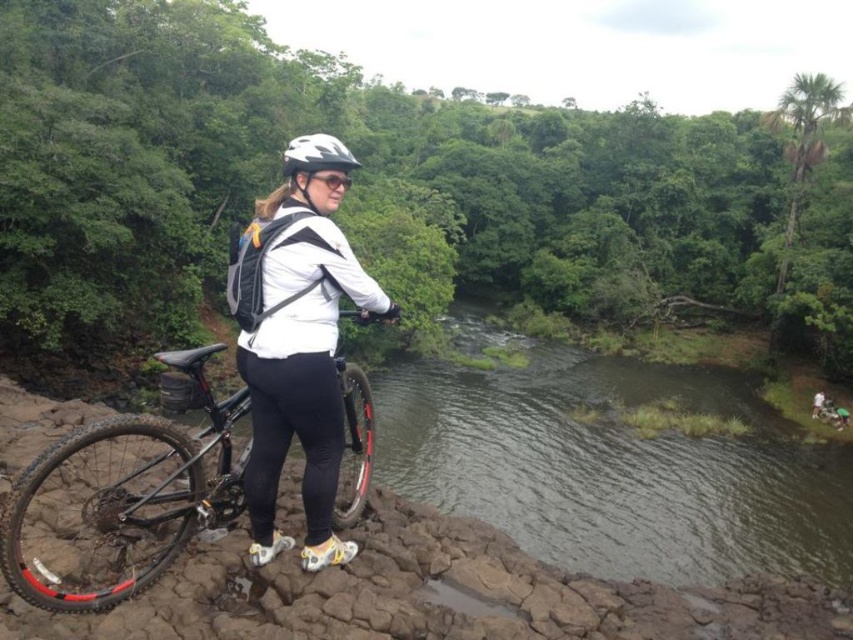
Looking at this image, you are a delivery person who needs to secure both the black matte bicycle at center and the white matte bicycle helmet at center in your truck. The truck has a loading ramp that can only accommodate items within a 10 meter distance from each other. Can you load both items onto the truck without moving them closer together?

The black matte bicycle at center and white matte bicycle helmet at center are 12.01 meters apart from each other, which exceeds the truck loading ramp distance limit of 10 meters. Therefore, you cannot load both items onto the truck without moving them closer together.

What is located at the coordinates point (134, 492)?

The black matte bicycle at center is located at point (134, 492).